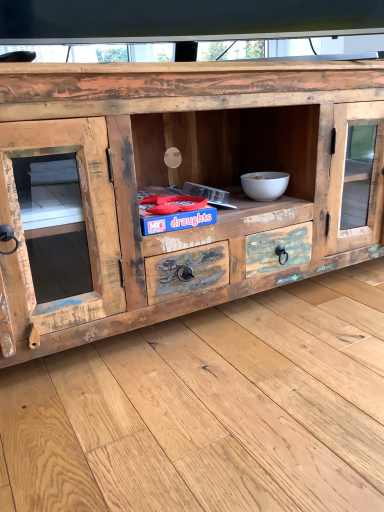
Question: Is white matte bowl at center-right at the back of rustic wood chest of drawers at center?

Choices:
 (A) no
 (B) yes

Answer: (B)

Question: Can white matte bowl at center-right be found inside rustic wood chest of drawers at center?

Choices:
 (A) no
 (B) yes

Answer: (B)

Question: Is rustic wood chest of drawers at center positioned beyond the bounds of white matte bowl at center-right?

Choices:
 (A) yes
 (B) no

Answer: (A)

Question: From the image's perspective, would you say rustic wood chest of drawers at center is positioned over white matte bowl at center-right?

Choices:
 (A) no
 (B) yes

Answer: (B)

Question: Does rustic wood chest of drawers at center have a lesser width compared to white matte bowl at center-right?

Choices:
 (A) yes
 (B) no

Answer: (B)

Question: Is rustic wood chest of drawers at center facing towards white matte bowl at center-right?

Choices:
 (A) no
 (B) yes

Answer: (B)

Question: From the image's perspective, is white matte bowl at center-right below rustic wood chest of drawers at center?

Choices:
 (A) no
 (B) yes

Answer: (B)

Question: Are white matte bowl at center-right and rustic wood chest of drawers at center making contact?

Choices:
 (A) yes
 (B) no

Answer: (B)

Question: Does white matte bowl at center-right come behind rustic wood chest of drawers at center?

Choices:
 (A) yes
 (B) no

Answer: (A)

Question: Is white matte bowl at center-right at the right side of rustic wood chest of drawers at center?

Choices:
 (A) yes
 (B) no

Answer: (A)

Question: Can you confirm if white matte bowl at center-right is taller than rustic wood chest of drawers at center?

Choices:
 (A) yes
 (B) no

Answer: (B)

Question: Does white matte bowl at center-right come in front of rustic wood chest of drawers at center?

Choices:
 (A) no
 (B) yes

Answer: (A)

Question: Is rustic wood chest of drawers at center bigger or smaller than white matte bowl at center-right?

Choices:
 (A) big
 (B) small

Answer: (A)